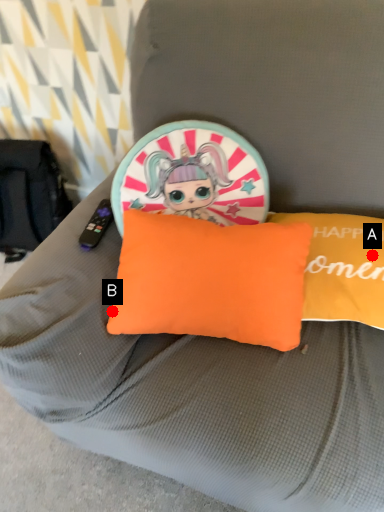
Question: Two points are circled on the image, labeled by A and B beside each circle. Which point is further to the camera?

Choices:
 (A) A is further
 (B) B is further

Answer: (A)